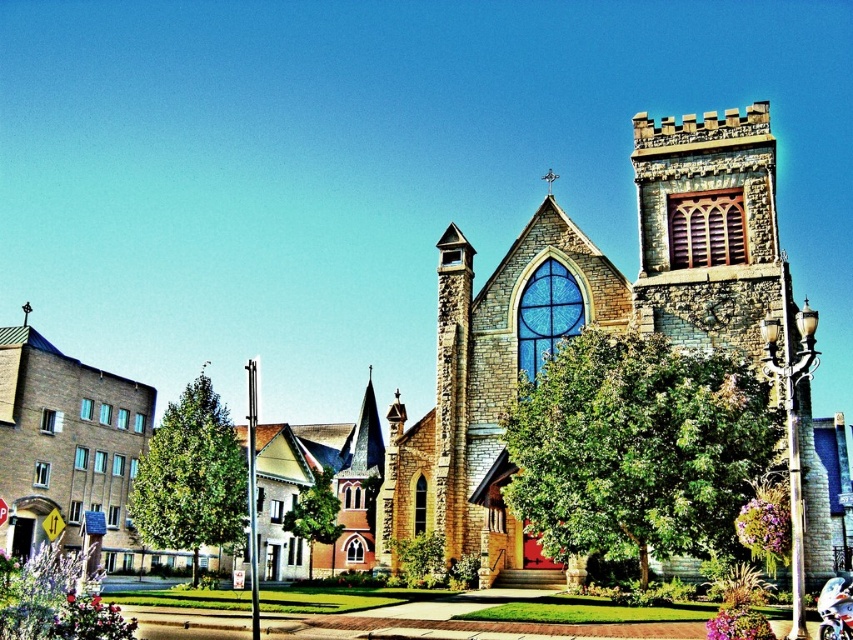
You are a photographer planning to capture the stone church at center and the metallic blue motorcycle at lower right in a single frame. Considering their heights, which object should you position closer to the camera to ensure both are fully visible in the photo?

Since the stone church at center is much taller than the metallic blue motorcycle at lower right, you should position the metallic blue motorcycle at lower right closer to the camera to ensure both objects are fully visible in the photo.

You are a visitor standing at the entrance of the stone church at center and want to park your metallic blue motorcycle at lower right. Which direction should you move relative to the church to reach the motorcycle?

The stone church at center is to the right of the metallic blue motorcycle at lower right, so to reach the motorcycle, you should move to the left relative to the church.